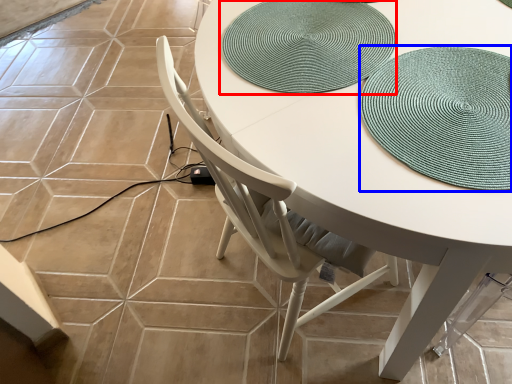
Question: Which object is closer to the camera taking this photo, mat (highlighted by a red box) or hat (highlighted by a blue box)?

Choices:
 (A) mat
 (B) hat

Answer: (B)